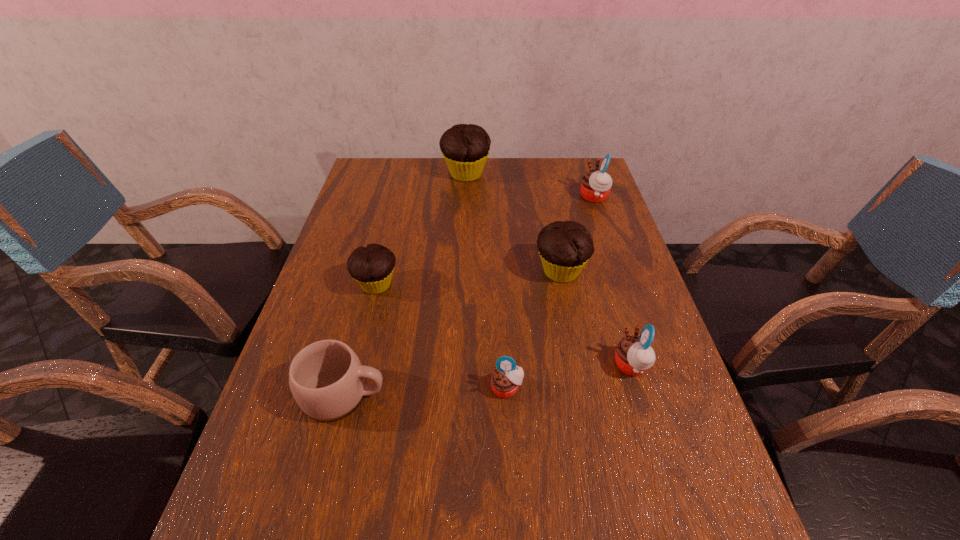
Locate an element on the screen. This screenshot has width=960, height=540. the farthest chocolate muffin is located at coordinates (465, 148).

Where is `the farthest muffin`? The width and height of the screenshot is (960, 540). the farthest muffin is located at coordinates (465, 148).

Image resolution: width=960 pixels, height=540 pixels. I want to click on the sixth nearest object, so [x=596, y=185].

Where is `the biggest pink muffin`? Image resolution: width=960 pixels, height=540 pixels. the biggest pink muffin is located at coordinates pyautogui.click(x=596, y=185).

Identify the location of the rightmost chocolate muffin. (565, 247).

You are a GUI agent. You are given a task and a screenshot of the screen. Output one action in this format:
    pyautogui.click(x=<x>, y=<y>)
    Task: Click on the third object from right to left
    The width and height of the screenshot is (960, 540).
    Given the screenshot: What is the action you would take?
    pyautogui.click(x=565, y=247)

Where is `the second biggest pink muffin`? This screenshot has height=540, width=960. the second biggest pink muffin is located at coordinates click(x=634, y=355).

The height and width of the screenshot is (540, 960). Identify the location of the smallest chocolate muffin. (372, 267).

The width and height of the screenshot is (960, 540). In order to click on the leftmost muffin in this screenshot , I will do `click(372, 267)`.

The image size is (960, 540). I want to click on mug, so click(326, 378).